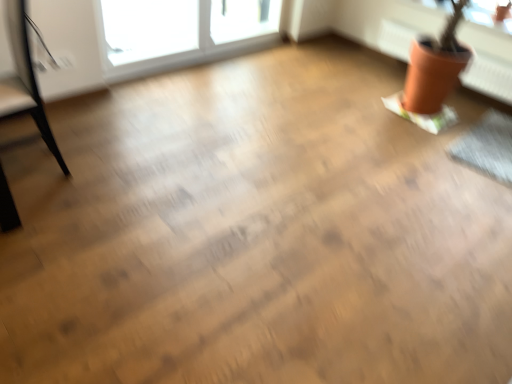
Question: In terms of width, does terracotta clay pot at upper right look wider or thinner when compared to transparent glass window screen at upper right?

Choices:
 (A) thin
 (B) wide

Answer: (B)

Question: Considering their positions, is terracotta clay pot at upper right located in front of or behind transparent glass window screen at upper right?

Choices:
 (A) front
 (B) behind

Answer: (A)

Question: Estimate the real-world distances between objects in this image. Which object is closer to the transparent glass window screen at upper right?

Choices:
 (A) terracotta clay pot at upper right
 (B) black leather armchair at left

Answer: (A)

Question: Which is nearer to the transparent glass window screen at upper right?

Choices:
 (A) terracotta clay pot at upper right
 (B) black leather armchair at left

Answer: (A)